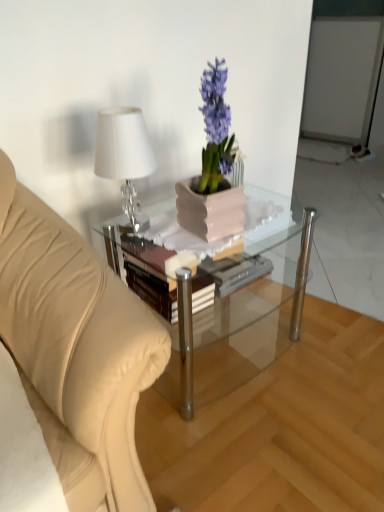
Image resolution: width=384 pixels, height=512 pixels. Describe the element at coordinates (212, 169) in the screenshot. I see `matte pink pot at center` at that location.

Based on the photo, measure the distance between clear glass coffee table at center and camera.

clear glass coffee table at center and camera are 1.17 meters apart from each other.

Image resolution: width=384 pixels, height=512 pixels. What do you see at coordinates (149, 276) in the screenshot?
I see `hardcover book at center` at bounding box center [149, 276].

Measure the distance between shiny silver table lamp at upper left and camera.

They are 1.05 meters apart.

Find the location of `matte pink pot at center`. matte pink pot at center is located at coordinates (212, 169).

From a real-world perspective, who is located higher, hardcover book at center or matte pink pot at center?

From a 3D spatial view, matte pink pot at center is above.

Does hardcover book at center turn towards matte pink pot at center?

No, hardcover book at center is not facing towards matte pink pot at center.

Which object is positioned more to the right, hardcover book at center or matte pink pot at center?

matte pink pot at center.

Between hardcover book at center and matte pink pot at center, which one has less height?

Standing shorter between the two is hardcover book at center.

From the picture: In the image, is shiny silver table lamp at upper left on the left side or the right side of clear glass coffee table at center?

In the image, shiny silver table lamp at upper left appears on the left side of clear glass coffee table at center.

From the image's perspective, is shiny silver table lamp at upper left under clear glass coffee table at center?

Actually, shiny silver table lamp at upper left appears above clear glass coffee table at center in the image.

Which is further, (137,228) or (259,326)?

The point (259,326) is farther.

Where is `coffee table below the shiny silver table lamp at upper left (from a real-world perspective)`? The image size is (384, 512). coffee table below the shiny silver table lamp at upper left (from a real-world perspective) is located at coordinates (242, 332).

Could you tell me if shiny silver table lamp at upper left is turned towards matte pink pot at center?

No, shiny silver table lamp at upper left is not aimed at matte pink pot at center.

How much distance is there between shiny silver table lamp at upper left and matte pink pot at center?

shiny silver table lamp at upper left is 7.19 inches away from matte pink pot at center.

Based on the photo, from a real-world perspective, is shiny silver table lamp at upper left positioned above or below matte pink pot at center?

From a real-world perspective, shiny silver table lamp at upper left is physically below matte pink pot at center.

Considering the positions of objects shiny silver table lamp at upper left and matte pink pot at center in the image provided, who is more to the right, shiny silver table lamp at upper left or matte pink pot at center?

matte pink pot at center.

In the scene shown: Is shiny silver table lamp at upper left next to hardcover book at center?

They are not placed beside each other.

Is shiny silver table lamp at upper left turned away from hardcover book at center?

No, shiny silver table lamp at upper left's orientation is not away from hardcover book at center.

You are a GUI agent. You are given a task and a screenshot of the screen. Output one action in this format:
    pyautogui.click(x=<x>, y=<y>)
    Task: Click on the table lamp located in front of the hardcover book at center
    
    Given the screenshot: What is the action you would take?
    pyautogui.click(x=124, y=156)

How different are the orientations of shiny silver table lamp at upper left and hardcover book at center in degrees?

The angle between the facing direction of shiny silver table lamp at upper left and the facing direction of hardcover book at center is 2.92 degrees.

Based on the photo, is clear glass coffee table at center oriented away from hardcover book at center?

Yes, clear glass coffee table at center's orientation is away from hardcover book at center.

Is clear glass coffee table at center further to the viewer compared to hardcover book at center?

No, it is not.

Is clear glass coffee table at center situated inside hardcover book at center or outside?

clear glass coffee table at center lies outside hardcover book at center.

From the image's perspective, which one is positioned higher, clear glass coffee table at center or hardcover book at center?

hardcover book at center appears higher in the image.

Is shiny silver table lamp at upper left surrounded by hardcover book at center?

Actually, shiny silver table lamp at upper left is outside hardcover book at center.

Consider the image. Which object is more forward, hardcover book at center or shiny silver table lamp at upper left?

shiny silver table lamp at upper left is more forward.

The height and width of the screenshot is (512, 384). I want to click on book on the right of shiny silver table lamp at upper left, so click(x=149, y=276).

From the image's perspective, is hardcover book at center located above shiny silver table lamp at upper left?

No.

Can you confirm if clear glass coffee table at center is shorter than shiny silver table lamp at upper left?

In fact, clear glass coffee table at center may be taller than shiny silver table lamp at upper left.

Consider the image. From a real-world perspective, is clear glass coffee table at center physically located above or below shiny silver table lamp at upper left?

In terms of real-world spatial position, clear glass coffee table at center is below shiny silver table lamp at upper left.

What's the angular difference between clear glass coffee table at center and shiny silver table lamp at upper left's facing directions?

clear glass coffee table at center and shiny silver table lamp at upper left are facing 0.781 degrees away from each other.

Which object is positioned more to the right, clear glass coffee table at center or shiny silver table lamp at upper left?

From the viewer's perspective, clear glass coffee table at center appears more on the right side.

Find the location of a particular element. book below the matte pink pot at center (from the image's perspective) is located at coordinates (149, 276).

You are a GUI agent. You are given a task and a screenshot of the screen. Output one action in this format:
    pyautogui.click(x=<x>, y=<y>)
    Task: Click on the table lamp that is on the left side of clear glass coffee table at center
    
    Given the screenshot: What is the action you would take?
    pyautogui.click(x=124, y=156)

Estimate the real-world distances between objects in this image. Which object is closer to clear glass coffee table at center, hardcover book at center or shiny silver table lamp at upper left?

hardcover book at center is closer to clear glass coffee table at center.

Consider the image. When comparing their distances from clear glass coffee table at center, does matte pink pot at center or hardcover book at center seem closer?

Among the two, hardcover book at center is located nearer to clear glass coffee table at center.

Which object lies nearer to the anchor point clear glass coffee table at center, shiny silver table lamp at upper left or hardcover book at center?

Among the two, hardcover book at center is located nearer to clear glass coffee table at center.

When comparing their distances from shiny silver table lamp at upper left, does clear glass coffee table at center or matte pink pot at center seem further?

clear glass coffee table at center is further to shiny silver table lamp at upper left.

Based on the photo, considering their positions, is clear glass coffee table at center positioned closer to hardcover book at center than matte pink pot at center?

Among the two, clear glass coffee table at center is located nearer to hardcover book at center.

Estimate the real-world distances between objects in this image. Which object is further from matte pink pot at center, clear glass coffee table at center or shiny silver table lamp at upper left?

clear glass coffee table at center is further to matte pink pot at center.

When comparing their distances from hardcover book at center, does clear glass coffee table at center or shiny silver table lamp at upper left seem further?

The object further to hardcover book at center is shiny silver table lamp at upper left.

Looking at the image, which one is located further to shiny silver table lamp at upper left, matte pink pot at center or clear glass coffee table at center?

Among the two, clear glass coffee table at center is located further to shiny silver table lamp at upper left.

Locate an element on the screen. table lamp between matte pink pot at center and clear glass coffee table at center in the up-down direction is located at coordinates (124, 156).

Find the location of a particular element. Image resolution: width=384 pixels, height=512 pixels. book between matte pink pot at center and clear glass coffee table at center vertically is located at coordinates (149, 276).

Find the location of `table lamp that lies between matte pink pot at center and hardcover book at center from top to bottom`. table lamp that lies between matte pink pot at center and hardcover book at center from top to bottom is located at coordinates (124, 156).

Where is `book between shiny silver table lamp at upper left and clear glass coffee table at center in the vertical direction`? The width and height of the screenshot is (384, 512). book between shiny silver table lamp at upper left and clear glass coffee table at center in the vertical direction is located at coordinates click(149, 276).